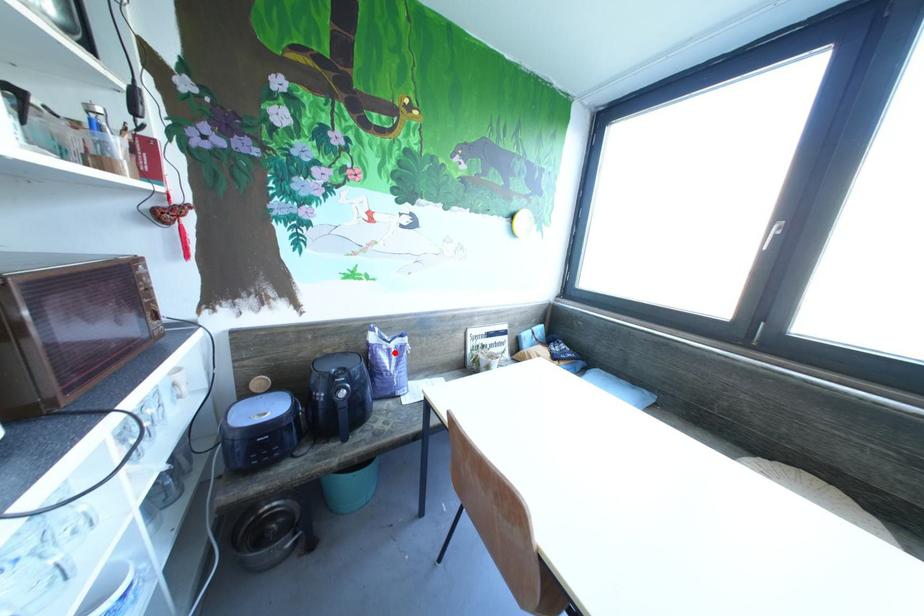
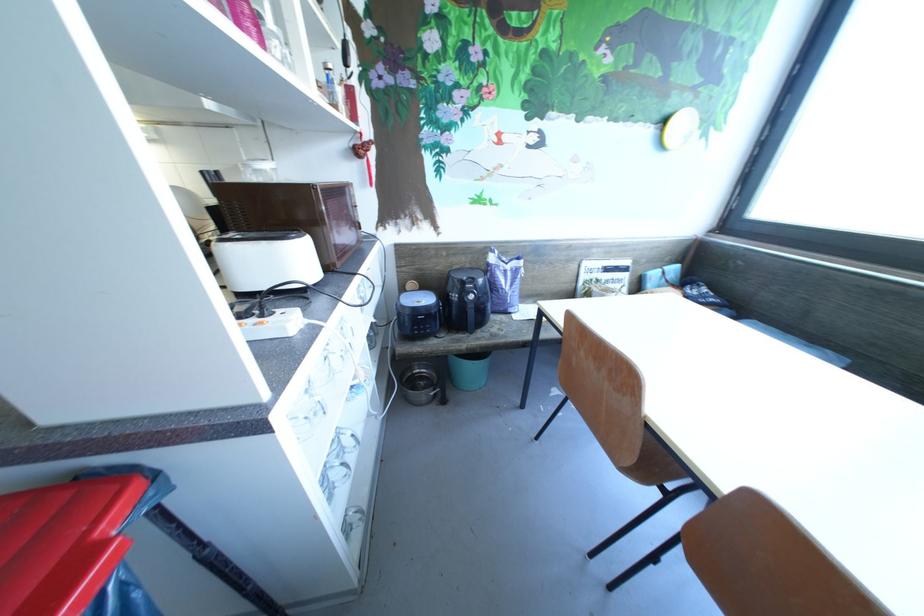
The point at the highlighted location is marked in the first image. Where is the corresponding point in the second image?

(512, 274)